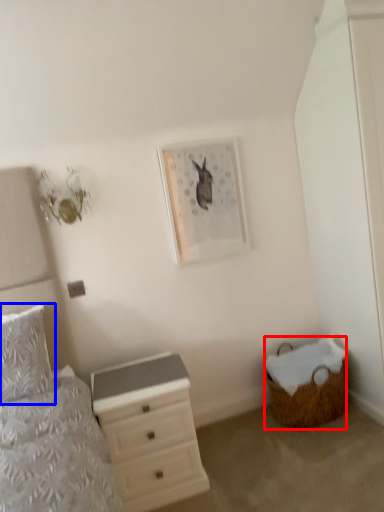
Question: Which object appears closest to the camera in this image, basket (highlighted by a red box) or pillow (highlighted by a blue box)?

Choices:
 (A) basket
 (B) pillow

Answer: (B)